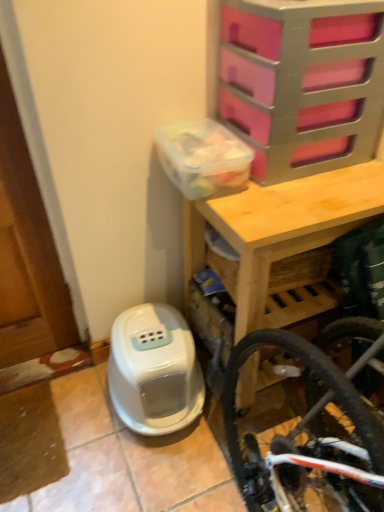
Question: From a real-world perspective, is pink plastic drawer at upper right located higher than white plastic water heater at lower left?

Choices:
 (A) no
 (B) yes

Answer: (B)

Question: Is pink plastic drawer at upper right facing towards white plastic water heater at lower left?

Choices:
 (A) no
 (B) yes

Answer: (A)

Question: Does pink plastic drawer at upper right have a greater height compared to white plastic water heater at lower left?

Choices:
 (A) no
 (B) yes

Answer: (B)

Question: Is white plastic water heater at lower left a part of pink plastic drawer at upper right?

Choices:
 (A) yes
 (B) no

Answer: (B)

Question: From the image's perspective, does pink plastic drawer at upper right appear lower than white plastic water heater at lower left?

Choices:
 (A) yes
 (B) no

Answer: (B)

Question: Looking at the image, does white plastic water heater at lower left seem bigger or smaller compared to pink plastic drawer at upper right?

Choices:
 (A) big
 (B) small

Answer: (B)

Question: Do you think white plastic water heater at lower left is within pink plastic drawer at upper right, or outside of it?

Choices:
 (A) outside
 (B) inside

Answer: (A)

Question: Does point (170, 317) appear closer or farther from the camera than point (241, 92)?

Choices:
 (A) closer
 (B) farther

Answer: (B)

Question: Based on their positions, is white plastic water heater at lower left located to the left or right of pink plastic drawer at upper right?

Choices:
 (A) right
 (B) left

Answer: (B)

Question: From a real-world perspective, is pink plastic drawer at upper right positioned above or below wooden table at upper center?

Choices:
 (A) above
 (B) below

Answer: (A)

Question: From the image's perspective, is pink plastic drawer at upper right located above or below wooden table at upper center?

Choices:
 (A) below
 (B) above

Answer: (B)

Question: In terms of height, does pink plastic drawer at upper right look taller or shorter compared to wooden table at upper center?

Choices:
 (A) tall
 (B) short

Answer: (B)

Question: Relative to wooden table at upper center, is pink plastic drawer at upper right in front or behind?

Choices:
 (A) behind
 (B) front

Answer: (B)

Question: Choose the correct answer: Is wooden table at upper center inside pink plastic drawer at upper right or outside it?

Choices:
 (A) outside
 (B) inside

Answer: (A)

Question: From a real-world perspective, is wooden table at upper center above or below pink plastic drawer at upper right?

Choices:
 (A) above
 (B) below

Answer: (B)